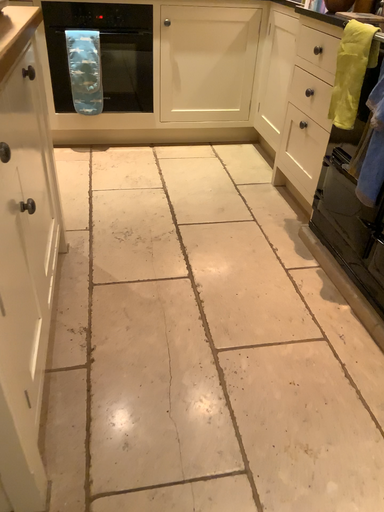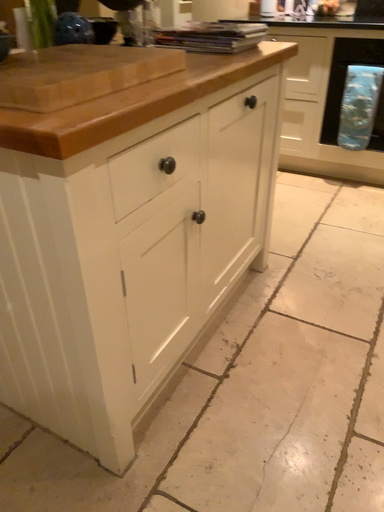
Question: How did the camera likely rotate when shooting the video?

Choices:
 (A) rotated right
 (B) rotated left

Answer: (B)